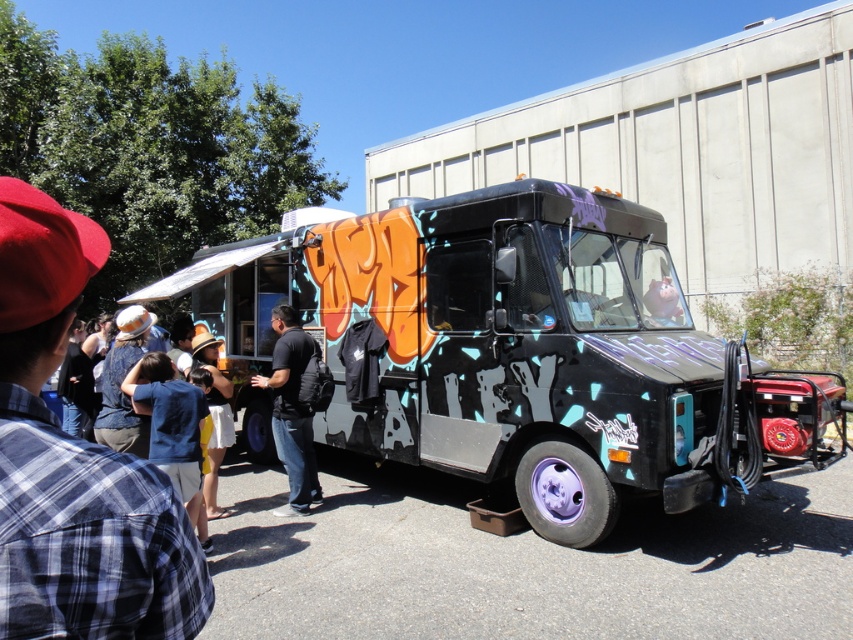
Question: Does plaid fabric shirt at left appear over yellow cotton shirt at center?

Choices:
 (A) yes
 (B) no

Answer: (A)

Question: Does plaid fabric shirt at left have a smaller size compared to yellow cotton shirt at center?

Choices:
 (A) no
 (B) yes

Answer: (B)

Question: Which object is positioned farthest from the black matte backpack at center?

Choices:
 (A) plaid fabric shirt at left
 (B) graffiti-covered truck at center
 (C) yellow cotton shirt at center

Answer: (A)

Question: Where is graffiti-covered truck at center located in relation to black matte backpack at center in the image?

Choices:
 (A) above
 (B) below

Answer: (B)

Question: Which of the following is the closest to the observer?

Choices:
 (A) yellow cotton shirt at center
 (B) black matte backpack at center
 (C) graffiti-covered truck at center

Answer: (C)

Question: Estimate the real-world distances between objects in this image. Which object is closer to the black matte backpack at center?

Choices:
 (A) plaid fabric shirt at left
 (B) graffiti-covered truck at center
 (C) yellow cotton shirt at center

Answer: (C)